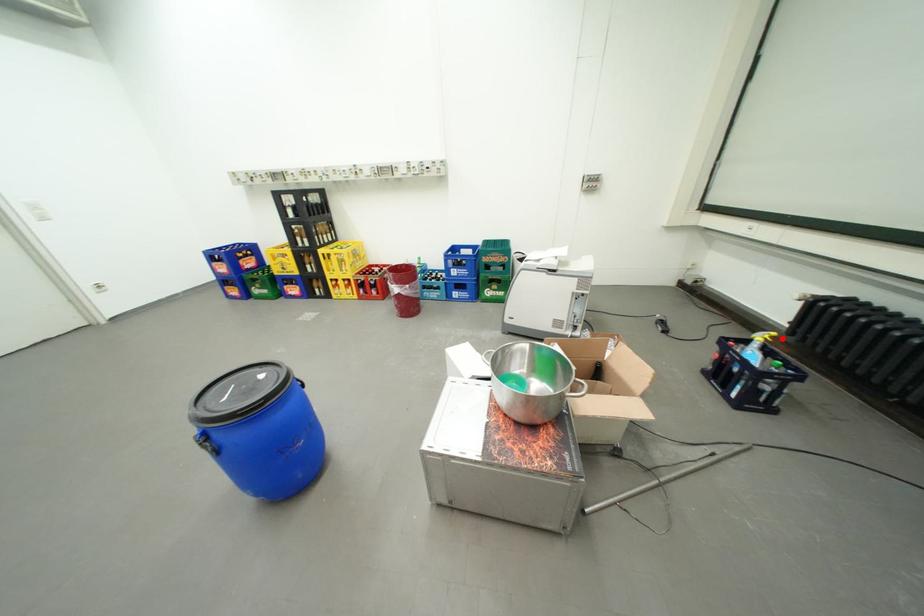
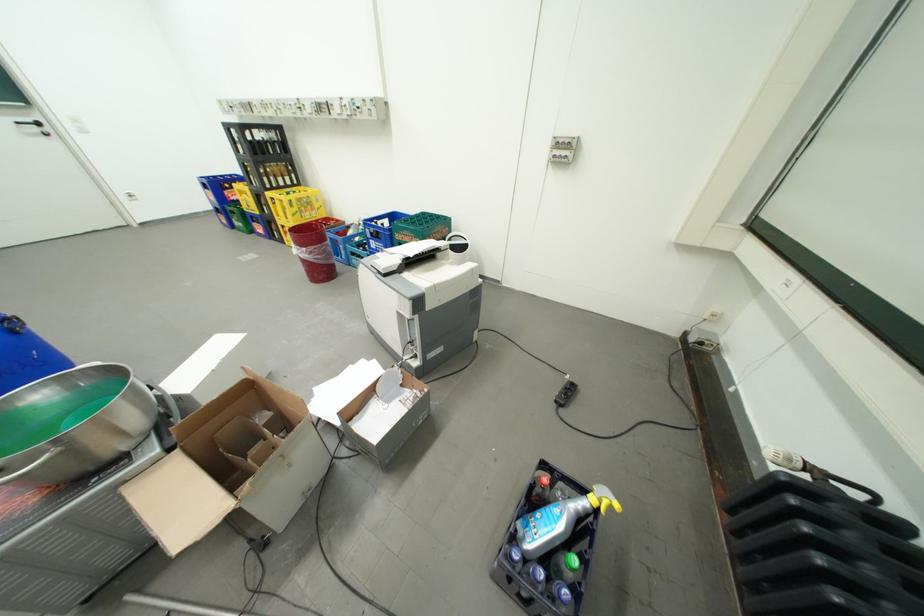
Where in the second image is the point corresponding to the highlighted location from the first image?

(622, 509)